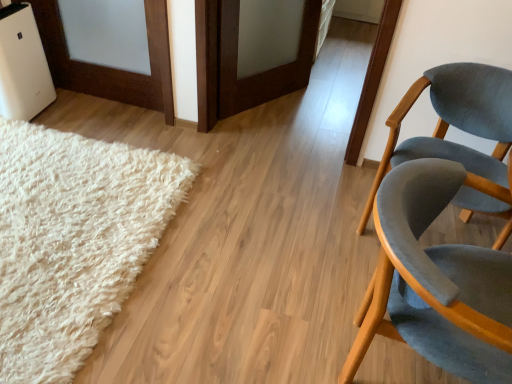
Identify the location of velvet grey chair at right, which is the 1th chair in front-to-back order. (435, 282).

Which is less distant, (116, 202) or (412, 87)?

The point (412, 87) is in front.

Image resolution: width=512 pixels, height=384 pixels. What are the coordinates of `mat below the matte gray chair at right, the first chair when ordered from back to front (from the image's perspective)` in the screenshot? It's located at (73, 241).

Is white fluffy rug at lower left oriented away from matte gray chair at right, the first chair when ordered from back to front?

That's not correct — white fluffy rug at lower left is not looking away from matte gray chair at right, the first chair when ordered from back to front.

Looking at their sizes, would you say white fluffy rug at lower left is wider or thinner than matte gray chair at right, placed as the 2th chair when sorted from front to back?

In the image, white fluffy rug at lower left appears to be wider than matte gray chair at right, placed as the 2th chair when sorted from front to back.

Does point (426, 80) appear closer or farther from the camera than point (89, 194)?

Point (426, 80) is closer to the camera than point (89, 194).

From the image's perspective, is matte gray chair at right, the first chair when ordered from back to front, above or below white fluffy rug at lower left?

matte gray chair at right, the first chair when ordered from back to front, is above white fluffy rug at lower left.

Consider the image. Is matte gray chair at right, placed as the 2th chair when sorted from front to back, far from white fluffy rug at lower left?

Yes.

What's the angular difference between velvet grey chair at right, which is counted as the 2th chair, starting from the back, and white fluffy rug at lower left's facing directions?

170 degrees.

Does point (442, 339) appear closer or farther from the camera than point (23, 331)?

Point (442, 339).

From a real-world perspective, is velvet grey chair at right, which is the 1th chair in front-to-back order, physically located above or below white fluffy rug at lower left?

In terms of real-world spatial position, velvet grey chair at right, which is the 1th chair in front-to-back order, is above white fluffy rug at lower left.

Are velvet grey chair at right, which is counted as the 2th chair, starting from the back, and matte gray chair at right, the first chair when ordered from back to front, far apart?

They are positioned close to each other.

From the picture: Is velvet grey chair at right, which is the 1th chair in front-to-back order, located outside matte gray chair at right, placed as the 2th chair when sorted from front to back?

Indeed, velvet grey chair at right, which is the 1th chair in front-to-back order, is completely outside matte gray chair at right, placed as the 2th chair when sorted from front to back.

Is velvet grey chair at right, which is the 1th chair in front-to-back order, taller or shorter than matte gray chair at right, the first chair when ordered from back to front?

Considering their sizes, velvet grey chair at right, which is the 1th chair in front-to-back order, has less height than matte gray chair at right, the first chair when ordered from back to front.

Looking at this image, which point is more distant from viewer, (481, 320) or (390, 131)?

Positioned behind is point (390, 131).

From a real-world perspective, who is located higher, matte gray chair at right, placed as the 2th chair when sorted from front to back, or velvet grey chair at right, which is the 1th chair in front-to-back order?

velvet grey chair at right, which is the 1th chair in front-to-back order, is physically above.

Is the surface of matte gray chair at right, the first chair when ordered from back to front, in direct contact with velvet grey chair at right, which is counted as the 2th chair, starting from the back?

matte gray chair at right, the first chair when ordered from back to front, and velvet grey chair at right, which is counted as the 2th chair, starting from the back, are clearly separated.

Is matte gray chair at right, placed as the 2th chair when sorted from front to back, oriented towards velvet grey chair at right, which is the 1th chair in front-to-back order?

Yes, matte gray chair at right, placed as the 2th chair when sorted from front to back, is facing velvet grey chair at right, which is the 1th chair in front-to-back order.

Considering the sizes of objects matte gray chair at right, the first chair when ordered from back to front, and velvet grey chair at right, which is counted as the 2th chair, starting from the back, in the image provided, who is smaller, matte gray chair at right, the first chair when ordered from back to front, or velvet grey chair at right, which is counted as the 2th chair, starting from the back,?

matte gray chair at right, the first chair when ordered from back to front.

Would you say white fluffy rug at lower left is inside or outside velvet grey chair at right, which is the 1th chair in front-to-back order?

The correct answer is: outside.

The image size is (512, 384). Identify the location of the 2nd chair above the white fluffy rug at lower left (from a real-world perspective). (435, 282).

Looking at this image, is white fluffy rug at lower left to the right of velvet grey chair at right, which is counted as the 2th chair, starting from the back, from the viewer's perspective?

No, white fluffy rug at lower left is not to the right of velvet grey chair at right, which is counted as the 2th chair, starting from the back.

From a real-world perspective, is white fluffy rug at lower left positioned under velvet grey chair at right, which is counted as the 2th chair, starting from the back, based on gravity?

Yes.

This screenshot has width=512, height=384. Identify the location of chair behind the white fluffy rug at lower left. (462, 130).

What are the coordinates of `mat beneath the matte gray chair at right, the first chair when ordered from back to front (from a real-world perspective)` in the screenshot? It's located at (73, 241).

Looking at the image, which one is located closer to matte gray chair at right, the first chair when ordered from back to front, velvet grey chair at right, which is counted as the 2th chair, starting from the back, or white fluffy rug at lower left?

velvet grey chair at right, which is counted as the 2th chair, starting from the back, is closer to matte gray chair at right, the first chair when ordered from back to front.

Looking at the image, which one is located further to matte gray chair at right, placed as the 2th chair when sorted from front to back, white fluffy rug at lower left or velvet grey chair at right, which is the 1th chair in front-to-back order?

white fluffy rug at lower left.

From the image, which object appears to be nearer to white fluffy rug at lower left, matte gray chair at right, placed as the 2th chair when sorted from front to back, or velvet grey chair at right, which is counted as the 2th chair, starting from the back?

Among the two, velvet grey chair at right, which is counted as the 2th chair, starting from the back, is located nearer to white fluffy rug at lower left.

Considering their positions, is velvet grey chair at right, which is counted as the 2th chair, starting from the back, positioned further to white fluffy rug at lower left than matte gray chair at right, the first chair when ordered from back to front?

matte gray chair at right, the first chair when ordered from back to front, is positioned further to the anchor white fluffy rug at lower left.

Looking at the image, which one is located further to velvet grey chair at right, which is the 1th chair in front-to-back order, matte gray chair at right, placed as the 2th chair when sorted from front to back, or white fluffy rug at lower left?

white fluffy rug at lower left.

Considering their positions, is white fluffy rug at lower left positioned closer to velvet grey chair at right, which is counted as the 2th chair, starting from the back, than matte gray chair at right, the first chair when ordered from back to front?

matte gray chair at right, the first chair when ordered from back to front, lies closer to velvet grey chair at right, which is counted as the 2th chair, starting from the back, than the other object.

Locate an element on the screen. The width and height of the screenshot is (512, 384). chair between white fluffy rug at lower left and matte gray chair at right, the first chair when ordered from back to front, from left to right is located at coordinates (435, 282).